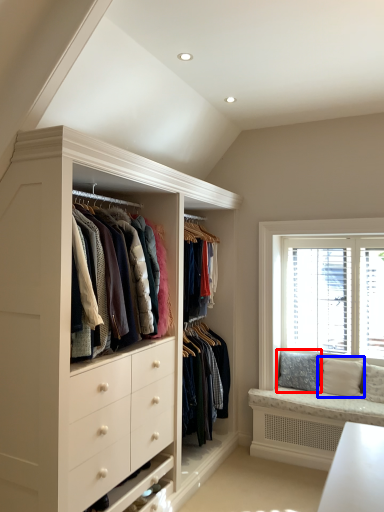
Question: Which object appears farthest to the camera in this image, pillow (highlighted by a red box) or pillow (highlighted by a blue box)?

Choices:
 (A) pillow
 (B) pillow

Answer: (A)